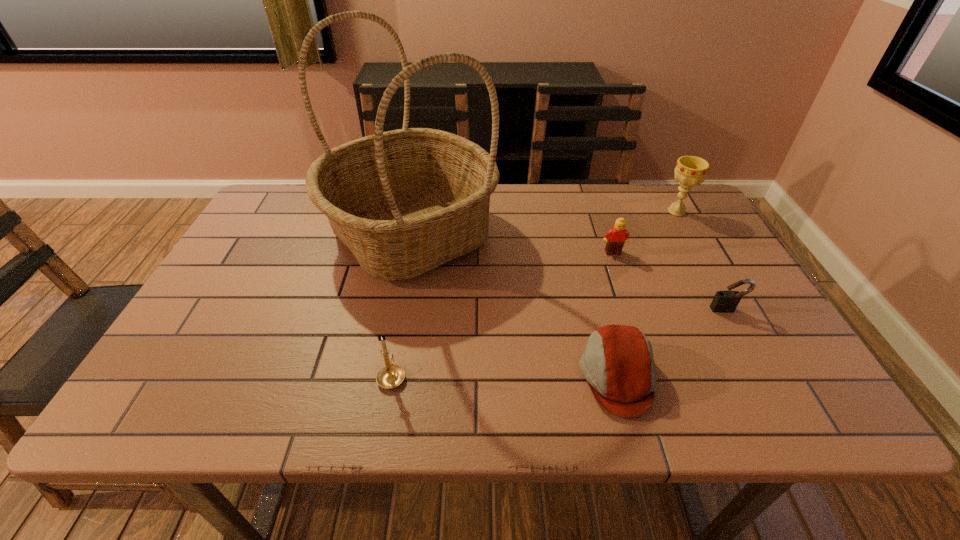
I want to click on basket, so click(406, 201).

Identify the location of chalice. The width and height of the screenshot is (960, 540). (690, 170).

Find the location of a particular element. This screenshot has width=960, height=540. candle holder is located at coordinates (390, 376).

Locate an element on the screen. Lego is located at coordinates (615, 238).

Find the location of a particular element. This screenshot has width=960, height=540. padlock is located at coordinates (724, 301).

Find the location of a particular element. This screenshot has width=960, height=540. cap is located at coordinates (618, 364).

The width and height of the screenshot is (960, 540). In order to click on blank space located 0.310m on the right of the tallest object in this screenshot , I will do coord(608,234).

Find the location of a particular element. The image size is (960, 540). vacant region located on the left of the chalice is located at coordinates (602, 212).

Find the location of a particular element. This screenshot has width=960, height=540. blank area located 0.280m on the handle side of the fourth shortest object is located at coordinates (410, 272).

Locate an element on the screen. The height and width of the screenshot is (540, 960). free space located on the handle side of the fourth shortest object is located at coordinates (403, 309).